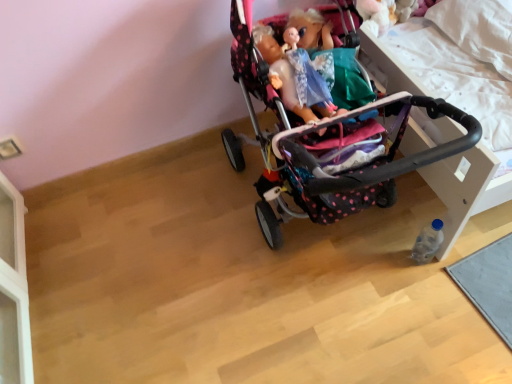
In order to click on free location in front of clear plastic bottle at lower right in this screenshot , I will do `click(439, 307)`.